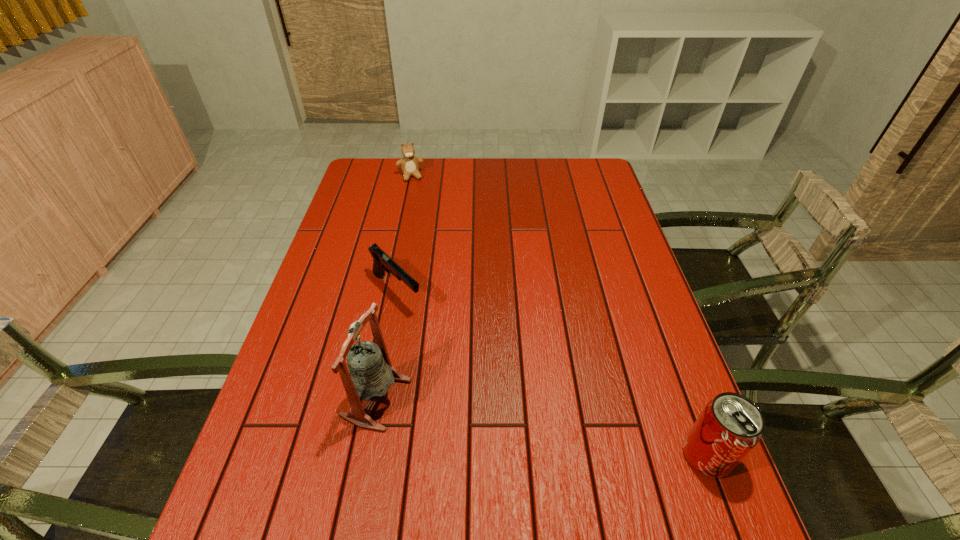
The height and width of the screenshot is (540, 960). Identify the location of object located in the near right corner section of the desktop. (729, 427).

Where is `free space at the far edge of the desktop`? Image resolution: width=960 pixels, height=540 pixels. free space at the far edge of the desktop is located at coordinates (550, 166).

The image size is (960, 540). I want to click on vacant space at the near edge of the desktop, so click(408, 451).

The height and width of the screenshot is (540, 960). In the image, there is a desktop. Identify the location of vacant space at the left edge. (353, 303).

Identify the location of vacant space at the right edge of the desktop. (594, 215).

In order to click on free space between the teddy bear and the third shortest object in this screenshot , I will do `click(559, 316)`.

Where is `free space between the bell and the farthest object`? The width and height of the screenshot is (960, 540). free space between the bell and the farthest object is located at coordinates (394, 287).

Locate an element on the screen. free space that is in between the pop soda and the tallest object is located at coordinates pyautogui.click(x=541, y=427).

Locate an element on the screen. The image size is (960, 540). vacant region between the third nearest object and the pop soda is located at coordinates (552, 374).

Find the location of a particular element. Image resolution: width=960 pixels, height=540 pixels. free area in between the gun and the rightmost object is located at coordinates (552, 374).